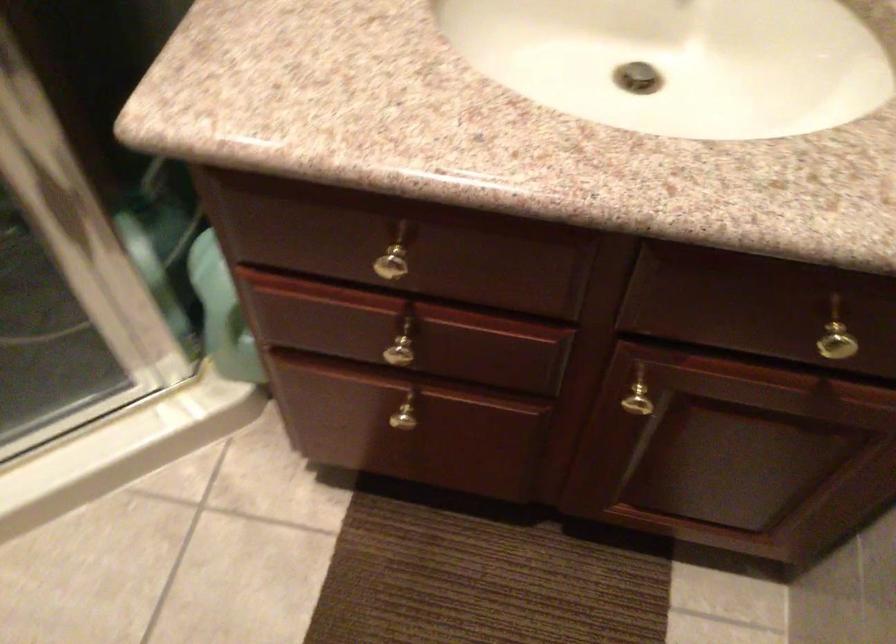
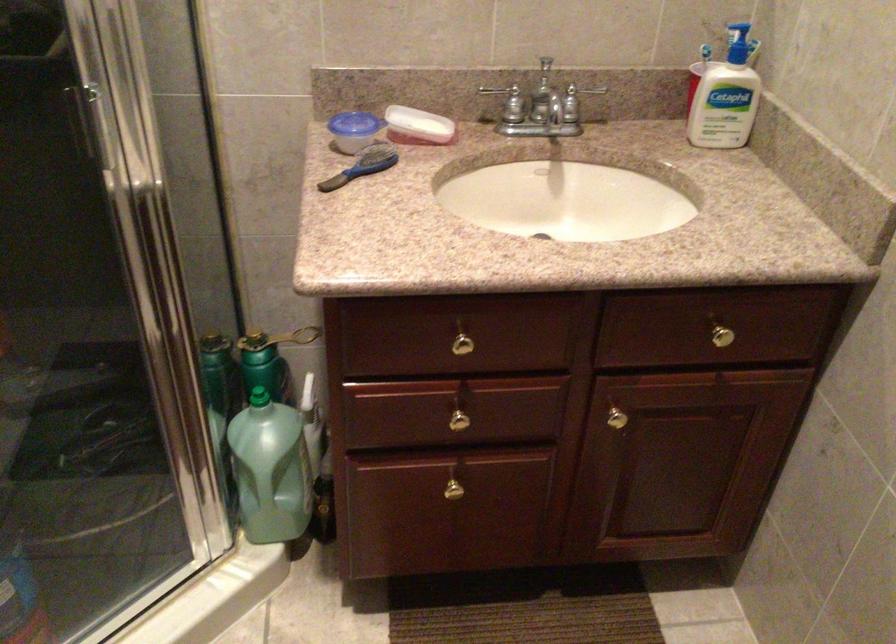
Locate, in the second image, the point that corresponds to pixel 641 384 in the first image.

(612, 411)